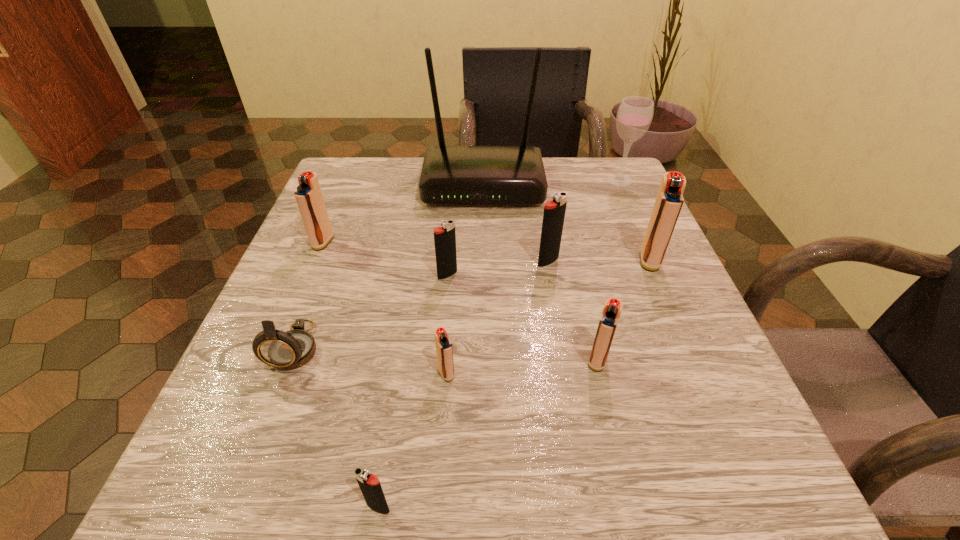
In order to click on the tallest object in this screenshot , I will do `click(450, 174)`.

Where is `wineglass`? Image resolution: width=960 pixels, height=540 pixels. wineglass is located at coordinates (634, 116).

Locate an element on the screen. the biggest red igniter is located at coordinates (669, 200).

I want to click on the tallest igniter, so click(669, 200).

Locate an element on the screen. This screenshot has height=540, width=960. the leftmost igniter is located at coordinates (308, 195).

I want to click on the second biggest red igniter, so click(308, 195).

Locate an element on the screen. The image size is (960, 540). the fifth igniter from left to right is located at coordinates (554, 211).

You are a GUI agent. You are given a task and a screenshot of the screen. Output one action in this format:
    pyautogui.click(x=<x>, y=<y>)
    Task: Click on the farthest black igniter
    
    Given the screenshot: What is the action you would take?
    pyautogui.click(x=554, y=211)

What are the coordinates of `the second smallest black igniter` in the screenshot? It's located at (444, 237).

Where is `the second farthest black igniter`? The width and height of the screenshot is (960, 540). the second farthest black igniter is located at coordinates (444, 237).